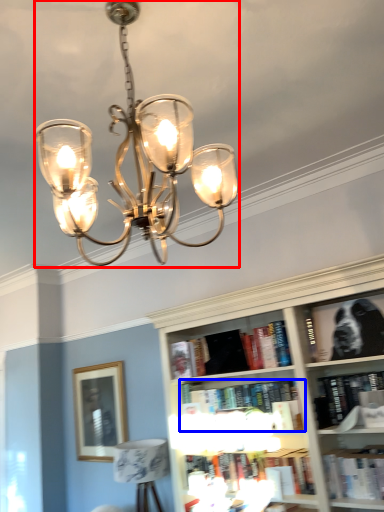
Question: Which of the following is the farthest to the observer, lamp (highlighted by a red box) or book (highlighted by a blue box)?

Choices:
 (A) lamp
 (B) book

Answer: (B)